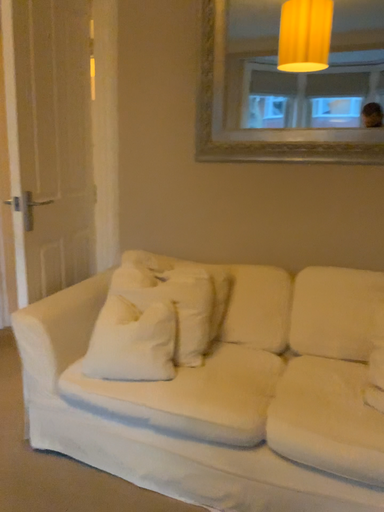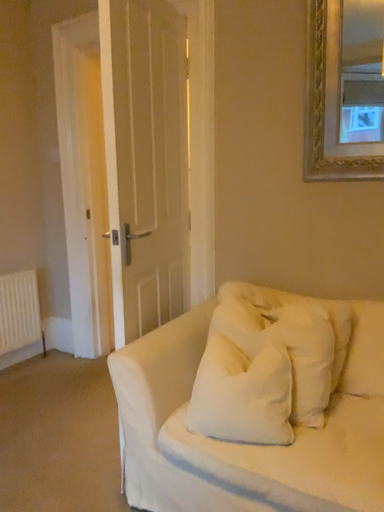
Question: Which way did the camera rotate in the video?

Choices:
 (A) rotated right
 (B) rotated left

Answer: (B)